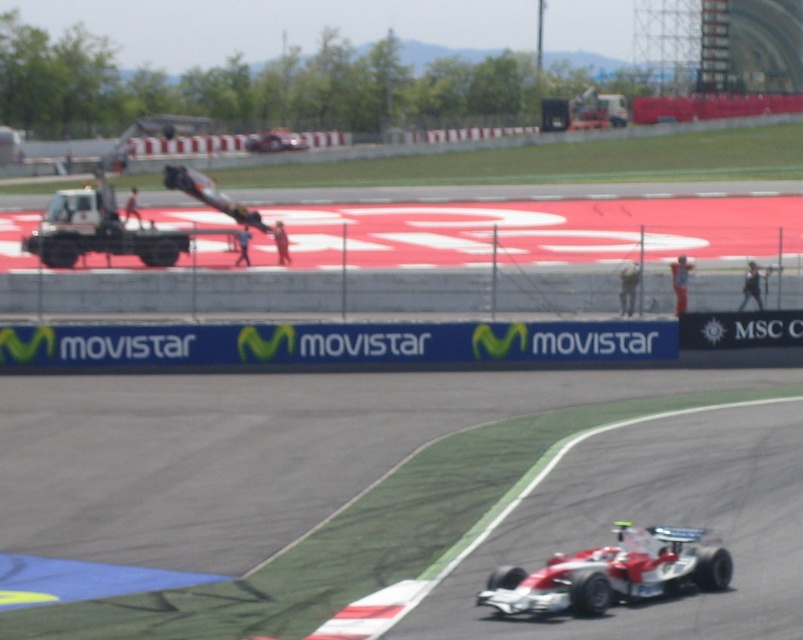
You are a race official at the Formula One track. You need to direct the white glossy race car at lower right to move to the left side of the white matte tow truck at left. Is this possible given their current positions?

The white glossy race car at lower right is currently on the right side of the white matte tow truck at left. To move it to the left side of the tow truck, the car would need to shift its position to the left, which is feasible as long as there is enough space on the track.

You are a race official who needs to park a new car that is 2 meters wide. You have two options on the track side, the white glossy race car at lower right and the white matte car at center. Which parking spot can accommodate the new car?

The white matte car at center has a greater width than the white glossy race car at lower right. Since the new car is 2 meters wide, the parking spot where the white matte car at center is located can accommodate it if its width is at least 2 meters. However, without knowing the exact width of the white matte car, we can only conclude that the white glossy race car at lower right is narrower and thus its parking spot is unsuitable. Therefore, the white matte car at center is the better option.

You are a race official standing at the side of the track. You need to move the white matte tow truck at left to a position behind the white matte car at center. Is the tow truck currently positioned below the car, making this possible without moving the car first?

The white matte tow truck at left is below the white matte car at center, so moving it behind the car would require adjusting its position upwards, not necessarily moving the car first.